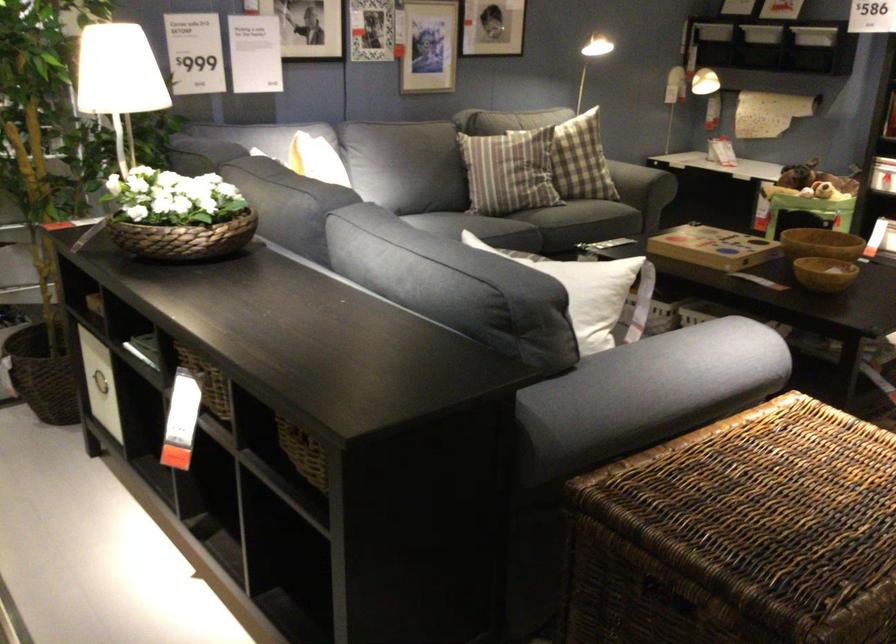
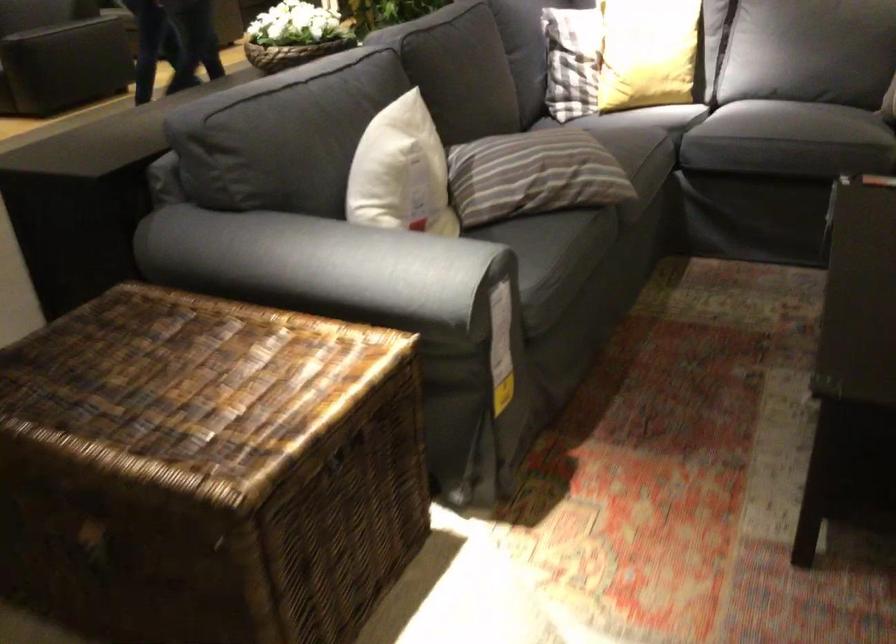
Locate, in the second image, the point that corresponds to point 768,468 in the first image.

(195, 389)